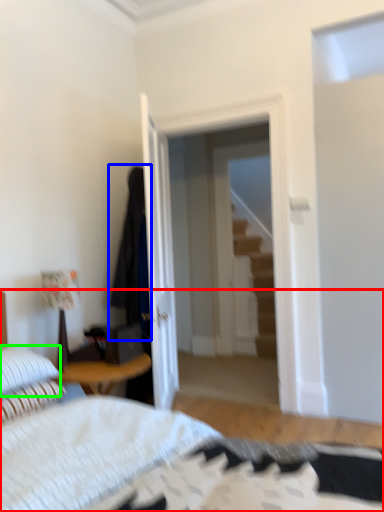
Question: Which object is positioned farthest from bed (highlighted by a red box)? Select from robe (highlighted by a blue box) and pillow (highlighted by a green box).

Choices:
 (A) robe
 (B) pillow

Answer: (A)